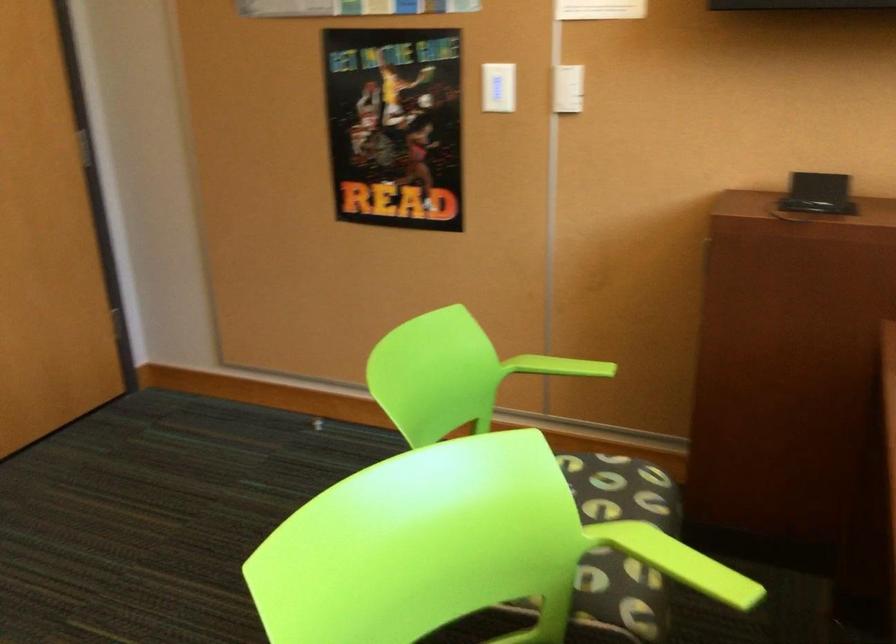
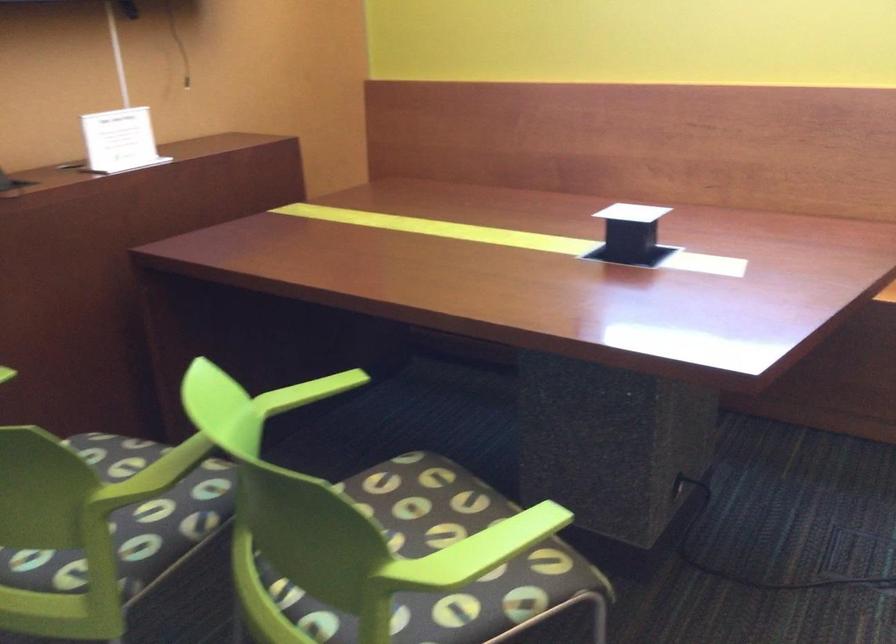
The point at [674,558] is marked in the first image. Where is the corresponding point in the second image?

(307, 392)